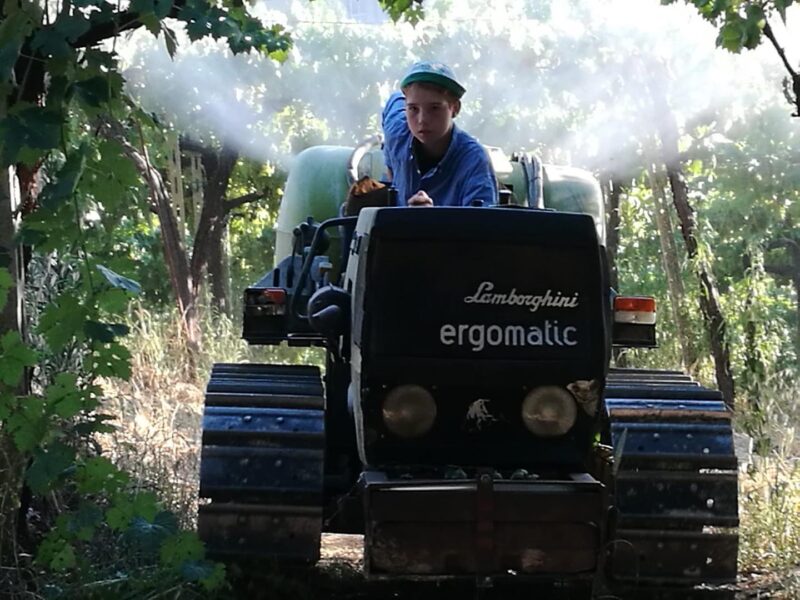
The image size is (800, 600). Find the location of `lights`. lights is located at coordinates (561, 407), (422, 418), (634, 320).